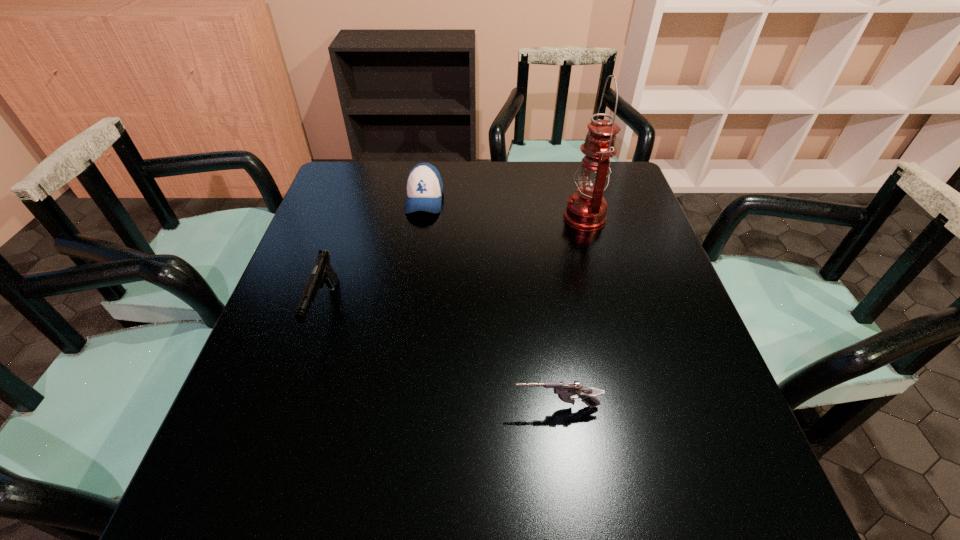
In the image, there is a desktop. Where is `vacant region at the near edge`? Image resolution: width=960 pixels, height=540 pixels. vacant region at the near edge is located at coordinates (x=360, y=510).

The image size is (960, 540). Find the location of `free space at the left edge of the desktop`. free space at the left edge of the desktop is located at coordinates (350, 211).

The width and height of the screenshot is (960, 540). What are the coordinates of `vacant space at the right edge of the desktop` in the screenshot? It's located at 675,420.

Where is `vacant region at the far left corner of the desktop`? vacant region at the far left corner of the desktop is located at coordinates (365, 161).

The height and width of the screenshot is (540, 960). In the image, there is a desktop. What are the coordinates of `free space at the far right corner` in the screenshot? It's located at (622, 161).

In order to click on unoccupied position between the left gun and the second shortest object in this screenshot , I will do `click(374, 254)`.

Where is `free space between the second nearest object and the second shortest object`? free space between the second nearest object and the second shortest object is located at coordinates (374, 254).

Find the location of a particular element. vacant area that lies between the baseball cap and the shortest object is located at coordinates (491, 303).

The height and width of the screenshot is (540, 960). In order to click on vacant point located between the rightmost object and the second object from left to right in this screenshot , I will do `click(505, 208)`.

At what (x,y) coordinates should I click in order to perform the action: click on unoccupied area between the farther gun and the tallest object. Please return your answer as a coordinate pair (x, y). The width and height of the screenshot is (960, 540). Looking at the image, I should click on (455, 264).